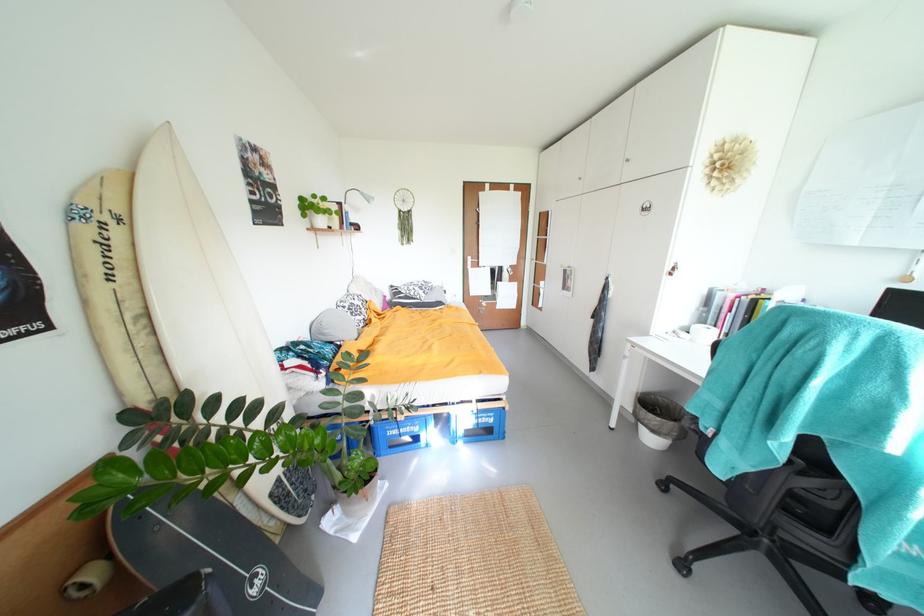
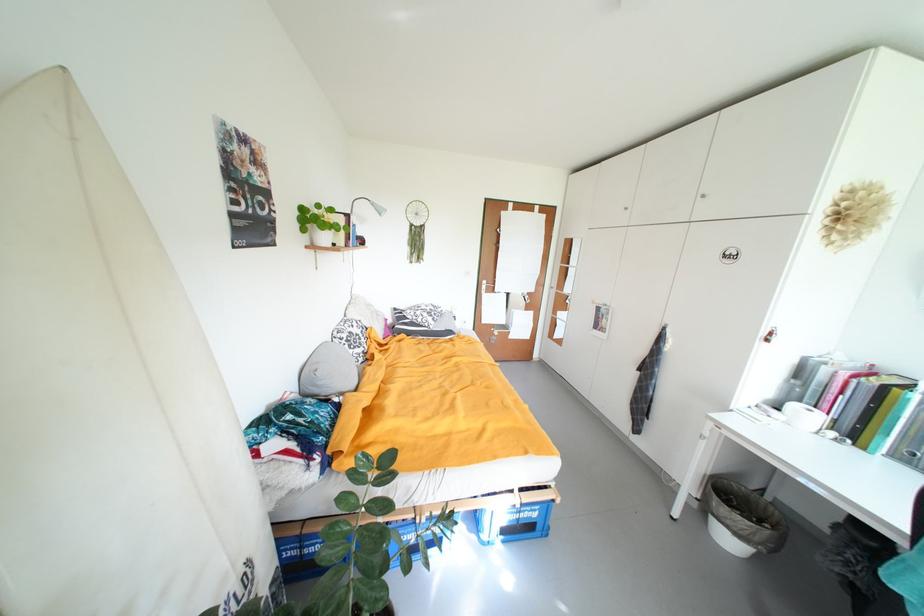
Where in the second image is the point corresponding to [393,299] from the first image?

(394, 322)